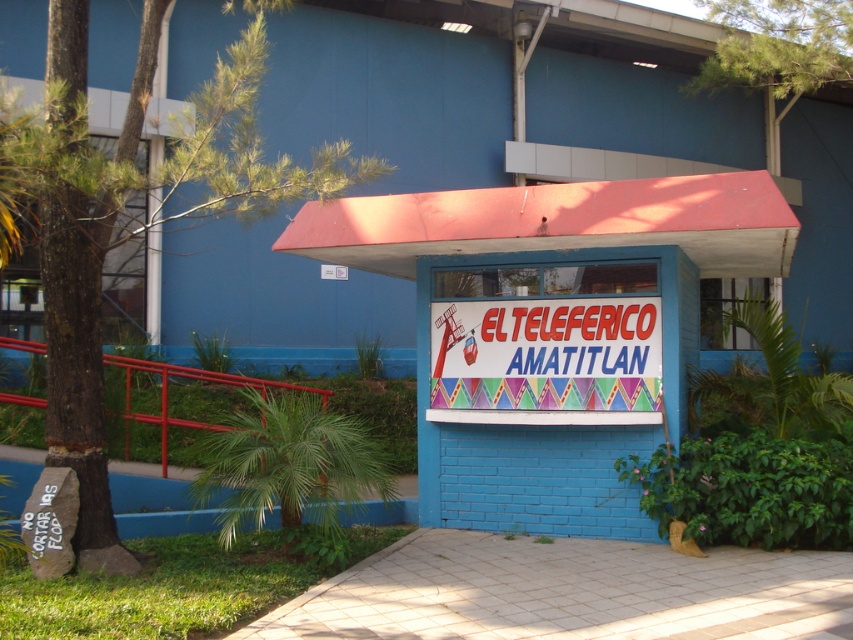
You are a tourist standing in front of the ticket booth and want to read both the blue painted brick sign at center and the colorful plastic sign at center. Which sign should you look to your left to see?

You should look to your left to see the colorful plastic sign at center because the blue painted brick sign at center is to the right of it.

You are a tour guide leading a group to the ticket booth. You need to inform your group about the distance between the blue painted brick sign at center and the colorful plastic sign at center. How far apart are they?

The blue painted brick sign at center is 54.41 centimeters away from the colorful plastic sign at center.